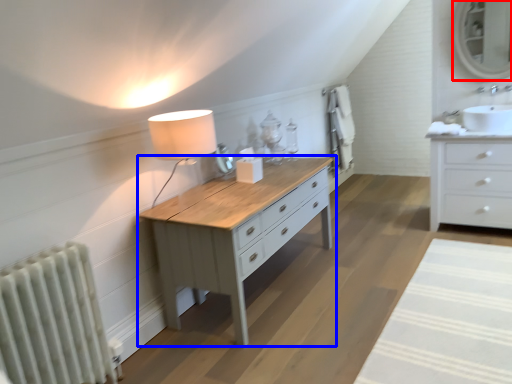
Question: Which object is closer to the camera taking this photo, mirror (highlighted by a red box) or table (highlighted by a blue box)?

Choices:
 (A) mirror
 (B) table

Answer: (B)